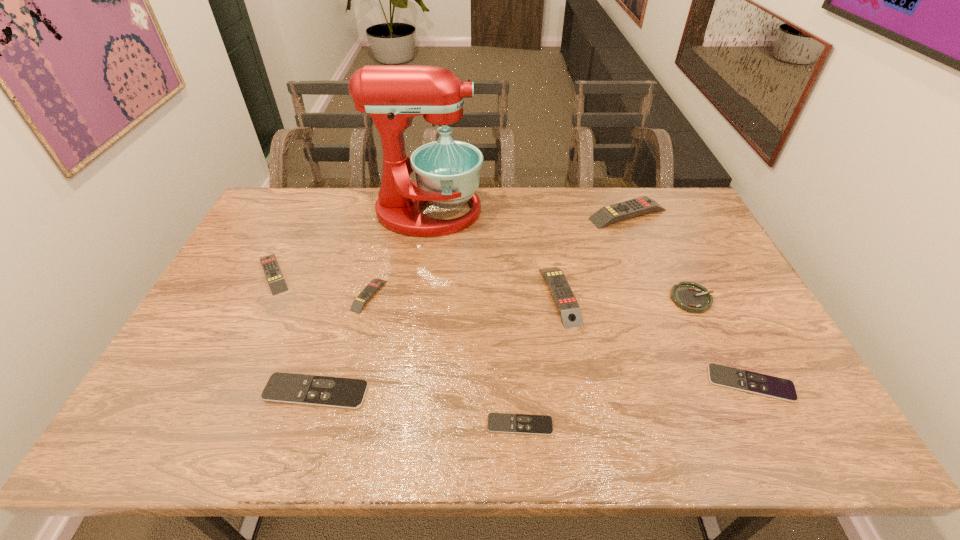
Find the location of a particular element. free spot between the red mixer and the nearest remote control is located at coordinates (474, 318).

The width and height of the screenshot is (960, 540). I want to click on free area in between the farthest yellow remote control and the fifth shortest remote control, so click(451, 244).

You are a GUI agent. You are given a task and a screenshot of the screen. Output one action in this format:
    pyautogui.click(x=<x>, y=<y>)
    Task: Click on the unoccupied position between the sixth tallest remote control and the biggest black remote control
    The height and width of the screenshot is (540, 960).
    Given the screenshot: What is the action you would take?
    pyautogui.click(x=533, y=388)

I want to click on empty space that is in between the sixth object from left to right and the biggest yellow remote control, so click(594, 255).

Locate an element on the screen. free spot between the nearest remote control and the third tallest object is located at coordinates (540, 360).

Where is `free space that is in between the leftmost yellow remote control and the sixth object from left to right`? free space that is in between the leftmost yellow remote control and the sixth object from left to right is located at coordinates (417, 285).

You are a GUI agent. You are given a task and a screenshot of the screen. Output one action in this format:
    pyautogui.click(x=<x>, y=<y>)
    Task: Click on the vacant area that lies between the second shortest object and the third tallest remote control
    Image resolution: width=960 pixels, height=540 pixels.
    Given the screenshot: What is the action you would take?
    pyautogui.click(x=512, y=328)

Where is `object that is the eighth closest one to the biggest black remote control`? The image size is (960, 540). object that is the eighth closest one to the biggest black remote control is located at coordinates (609, 214).

Identify the location of the sixth closest object to the nearest object. (447, 172).

Find the location of a particular element. Image resolution: width=960 pixels, height=540 pixels. the sixth closest remote control to the tallest remote control is located at coordinates coord(277,284).